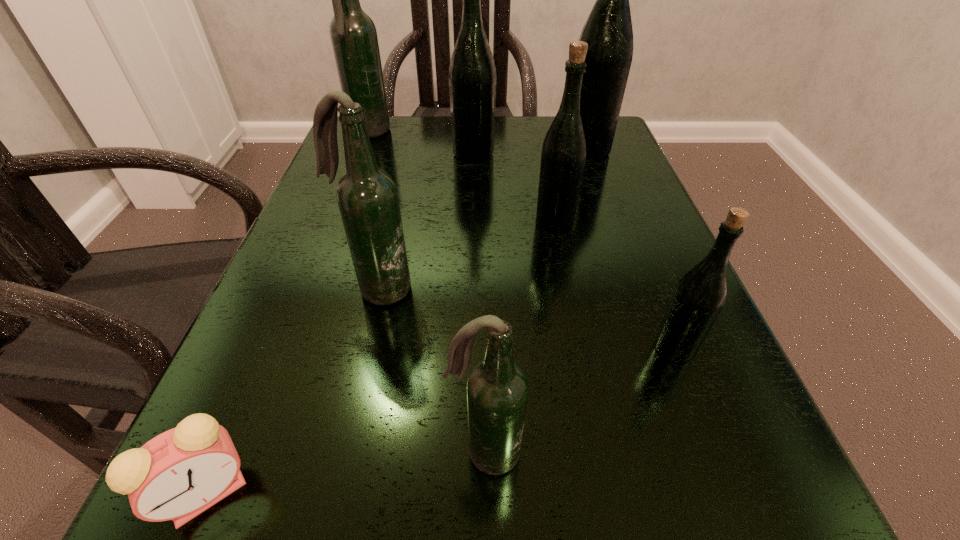
Where is `the second closest dark beer bottle to the biggest green beer bottle`? This screenshot has width=960, height=540. the second closest dark beer bottle to the biggest green beer bottle is located at coordinates (367, 197).

Find the location of a particular element. The image size is (960, 540). dark beer bottle that is the second closest to the biggest dark beer bottle is located at coordinates (497, 389).

I want to click on free spot that satisfies the following two spatial constraints: 1. on the back side of the second smallest green beer bottle; 2. on the right side of the nearest beer bottle, so click(x=483, y=221).